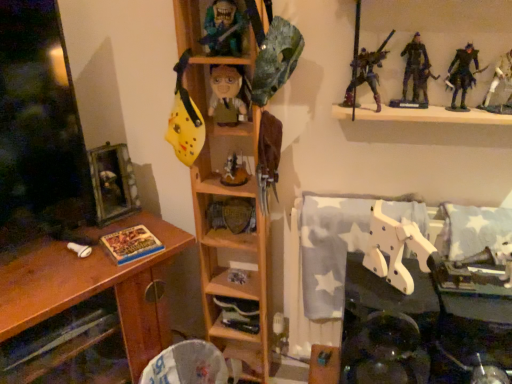
Question: Is point (137, 213) closer or farther from the camera than point (105, 196)?

Choices:
 (A) closer
 (B) farther

Answer: (B)

Question: From the image's perspective, is brown wood desk at left positioned above or below wooden framed picture at left?

Choices:
 (A) above
 (B) below

Answer: (B)

Question: Considering the real-world distances, which object is farthest from the wooden framed picture at left?

Choices:
 (A) white plastic sword at upper right, acting as the 3th toy starting from the top
 (B) dark blue fabric figure at upper right, the 3th person in the left-to-right sequence
 (C) metallic purple figure at upper center, arranged as the second person when viewed from the left
 (D) wooden plaque at center, acting as the 1th shelf starting from the left
 (E) dark gray plastic figure at upper right, arranged as the fourth toy when ordered from the bottom

Answer: (A)

Question: Based on their relative distances, which object is farther from the dark gray plastic figure at upper right, marked as the 2th toy in a right-to-left arrangement?

Choices:
 (A) wooden shelf at center, which ranks as the 2th shelf in right-to-left order
 (B) white wood robot at lower right, acting as the 1th toy starting from the bottom
 (C) metallic action figures at upper right, which is counted as the 1th shelf, starting from the right
 (D) white plastic sword at upper right, which is counted as the fifth toy, starting from the left
 (E) wooden framed picture at left

Answer: (E)